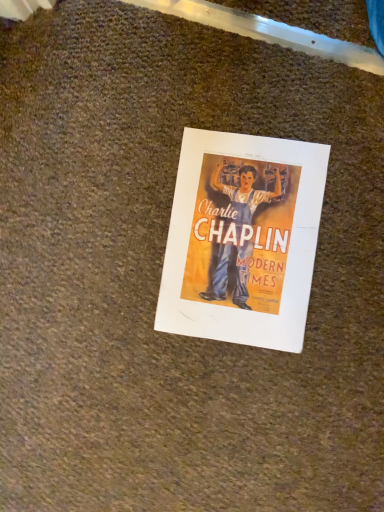
Image resolution: width=384 pixels, height=512 pixels. Describe the element at coordinates (242, 239) in the screenshot. I see `matte paper poster at center` at that location.

The image size is (384, 512). What are the coordinates of `matte paper poster at center` in the screenshot? It's located at (242, 239).

Measure the distance between matte paper poster at center and camera.

matte paper poster at center is 23.38 inches away from camera.

The width and height of the screenshot is (384, 512). What are the coordinates of `matte paper poster at center` in the screenshot? It's located at (242, 239).